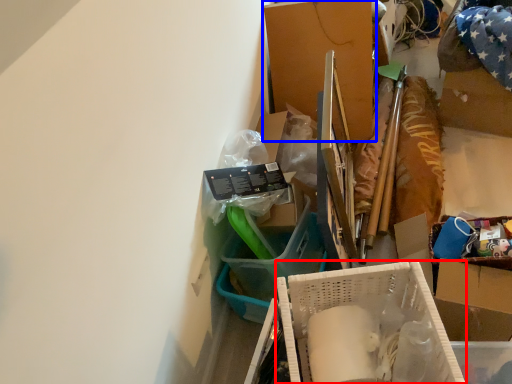
Question: Which object appears closest to the camera in this image, box (highlighted by a red box) or box (highlighted by a blue box)?

Choices:
 (A) box
 (B) box

Answer: (A)